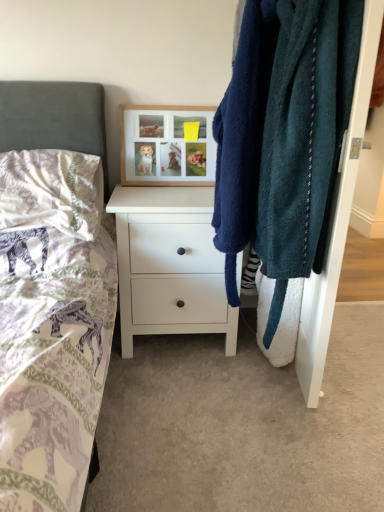
Question: Is white matte chest of drawers at center at the right side of silky white pillow at left?

Choices:
 (A) no
 (B) yes

Answer: (B)

Question: Would you say white matte chest of drawers at center is outside silky white pillow at left?

Choices:
 (A) yes
 (B) no

Answer: (A)

Question: From a real-world perspective, is white matte chest of drawers at center beneath silky white pillow at left?

Choices:
 (A) yes
 (B) no

Answer: (A)

Question: Considering the relative sizes of white matte chest of drawers at center and silky white pillow at left in the image provided, is white matte chest of drawers at center thinner than silky white pillow at left?

Choices:
 (A) no
 (B) yes

Answer: (A)

Question: Considering the relative positions of white matte chest of drawers at center and silky white pillow at left in the image provided, is white matte chest of drawers at center to the left of silky white pillow at left from the viewer's perspective?

Choices:
 (A) yes
 (B) no

Answer: (B)

Question: From the image's perspective, relative to teal fuzzy robe at right, is woodenobject at upper center above or below?

Choices:
 (A) above
 (B) below

Answer: (A)

Question: Looking at their shapes, would you say woodenobject at upper center is wider or thinner than teal fuzzy robe at right?

Choices:
 (A) wide
 (B) thin

Answer: (B)

Question: In the image, is woodenobject at upper center on the left side or the right side of teal fuzzy robe at right?

Choices:
 (A) right
 (B) left

Answer: (B)

Question: Based on their sizes in the image, would you say woodenobject at upper center is bigger or smaller than teal fuzzy robe at right?

Choices:
 (A) big
 (B) small

Answer: (B)

Question: In the image, is woodenobject at upper center positioned in front of or behind white matte chest of drawers at center?

Choices:
 (A) front
 (B) behind

Answer: (B)

Question: Would you say woodenobject at upper center is to the left or to the right of white matte chest of drawers at center in the picture?

Choices:
 (A) left
 (B) right

Answer: (A)

Question: In terms of height, does woodenobject at upper center look taller or shorter compared to white matte chest of drawers at center?

Choices:
 (A) short
 (B) tall

Answer: (A)

Question: Is woodenobject at upper center inside the boundaries of white matte chest of drawers at center, or outside?

Choices:
 (A) outside
 (B) inside

Answer: (A)

Question: Is white matte chest of drawers at center in front of or behind woodenobject at upper center in the image?

Choices:
 (A) behind
 (B) front

Answer: (B)

Question: In terms of height, does white matte chest of drawers at center look taller or shorter compared to woodenobject at upper center?

Choices:
 (A) short
 (B) tall

Answer: (B)